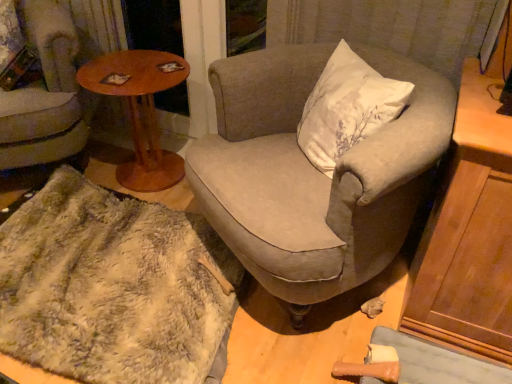
Question: Can wooden round table at left be found inside textured gray armchair at center, marked as the second chair in a left-to-right arrangement?

Choices:
 (A) yes
 (B) no

Answer: (B)

Question: Is textured gray armchair at center, the first chair positioned from the right, thinner than wooden round table at left?

Choices:
 (A) yes
 (B) no

Answer: (B)

Question: Does textured gray armchair at center, the first chair positioned from the right, have a smaller size compared to wooden round table at left?

Choices:
 (A) no
 (B) yes

Answer: (A)

Question: Is textured gray armchair at center, the first chair positioned from the right, positioned far away from wooden round table at left?

Choices:
 (A) yes
 (B) no

Answer: (B)

Question: Is textured gray armchair at center, marked as the second chair in a left-to-right arrangement, at the right side of wooden round table at left?

Choices:
 (A) yes
 (B) no

Answer: (A)

Question: Is textured gray armchair at center, marked as the second chair in a left-to-right arrangement, wider than wooden round table at left?

Choices:
 (A) no
 (B) yes

Answer: (B)

Question: Considering the relative sizes of fuzzy white blanket at lower left and wooden round table at left in the image provided, is fuzzy white blanket at lower left thinner than wooden round table at left?

Choices:
 (A) no
 (B) yes

Answer: (A)

Question: From the image's perspective, is fuzzy white blanket at lower left below wooden round table at left?

Choices:
 (A) yes
 (B) no

Answer: (A)

Question: Is wooden round table at left located within fuzzy white blanket at lower left?

Choices:
 (A) no
 (B) yes

Answer: (A)

Question: Are fuzzy white blanket at lower left and wooden round table at left far apart?

Choices:
 (A) no
 (B) yes

Answer: (A)

Question: Is fuzzy white blanket at lower left in contact with wooden round table at left?

Choices:
 (A) no
 (B) yes

Answer: (A)

Question: Does fuzzy white blanket at lower left lie behind wooden round table at left?

Choices:
 (A) yes
 (B) no

Answer: (B)

Question: Is fuzzy fabric chair at lower left, arranged as the 2th chair when viewed from the right, aimed at wooden round table at left?

Choices:
 (A) no
 (B) yes

Answer: (A)